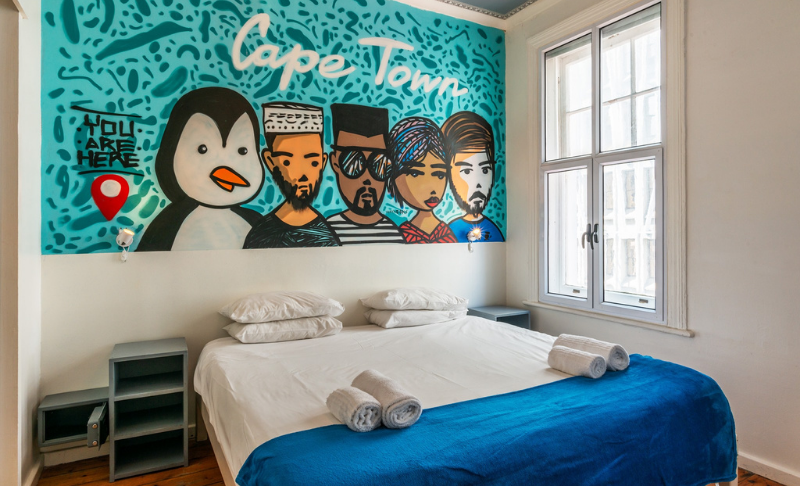
The image size is (800, 486). Identify the location of storage. (154, 369).